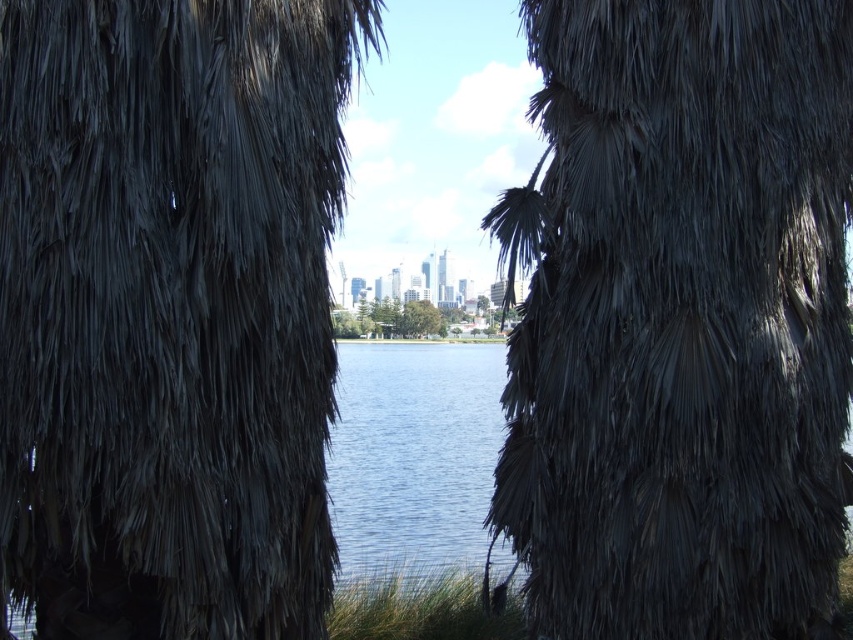
Is point (71, 504) positioned before point (415, 328)?

Yes, point (71, 504) is in front of point (415, 328).

In order to click on dark gray textured palm tree at center in this screenshot , I will do `click(169, 310)`.

This screenshot has width=853, height=640. I want to click on dark gray textured palm tree at center, so click(x=169, y=310).

Can you confirm if dark gray textured palm tree at center is wider than dark brown textured palm tree at center?

Incorrect, dark gray textured palm tree at center's width does not surpass dark brown textured palm tree at center's.

Is dark gray textured palm tree at center to the left of dark brown textured palm tree at center from the viewer's perspective?

Yes, dark gray textured palm tree at center is to the left of dark brown textured palm tree at center.

Image resolution: width=853 pixels, height=640 pixels. Describe the element at coordinates (169, 310) in the screenshot. I see `dark gray textured palm tree at center` at that location.

This screenshot has height=640, width=853. I want to click on dark gray textured palm tree at center, so click(x=169, y=310).

Between dark brown textured palm tree at center and green leafy tree at center, which one appears on the left side from the viewer's perspective?

Positioned to the left is green leafy tree at center.

Who is taller, dark brown textured palm tree at center or green leafy tree at center?

Standing taller between the two is dark brown textured palm tree at center.

Locate an element on the screen. dark brown textured palm tree at center is located at coordinates (682, 321).